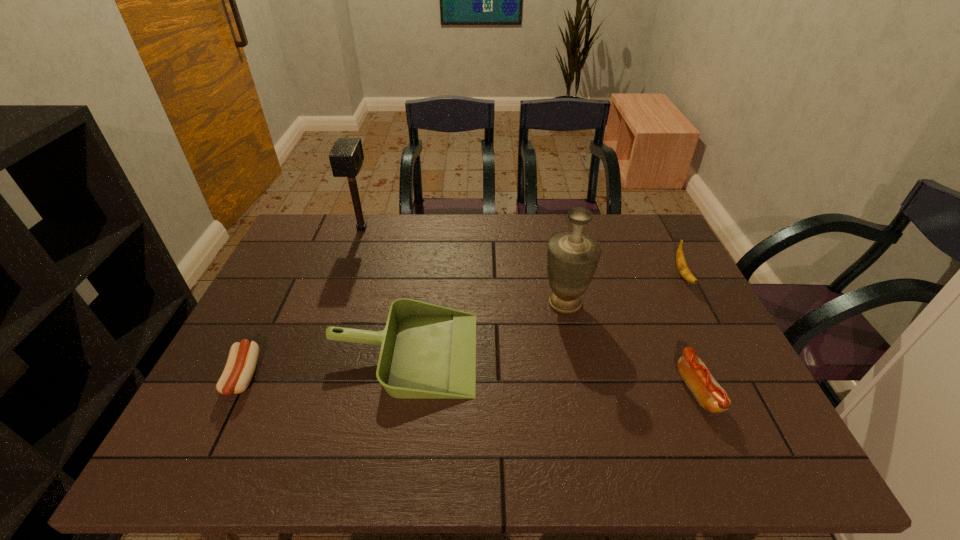
Identify the location of free spot at the left edge of the desktop. The height and width of the screenshot is (540, 960). (302, 261).

The width and height of the screenshot is (960, 540). What are the coordinates of `vacant space at the right edge of the desktop` in the screenshot? It's located at (763, 416).

You are a GUI agent. You are given a task and a screenshot of the screen. Output one action in this format:
    pyautogui.click(x=<x>, y=<y>)
    Task: Click on the unoccupied position between the dustpan and the mallet
    This screenshot has width=960, height=540.
    Given the screenshot: What is the action you would take?
    pyautogui.click(x=383, y=291)

At what (x,y) coordinates should I click in order to perform the action: click on vacant space in between the banana and the urn. Please return your answer as a coordinate pair (x, y). This screenshot has height=540, width=960. Looking at the image, I should click on (624, 289).

What are the coordinates of `vacant space in between the mallet and the shorter sausage` in the screenshot? It's located at (302, 302).

You are a GUI agent. You are given a task and a screenshot of the screen. Output one action in this format:
    pyautogui.click(x=<x>, y=<y>)
    Task: Click on the vacant region between the farthest object and the urn
    This screenshot has height=540, width=960.
    Given the screenshot: What is the action you would take?
    click(464, 266)

Find the location of a particular element. The height and width of the screenshot is (540, 960). empty location between the fourth object from left to right and the rightmost object is located at coordinates (624, 289).

I want to click on vacant region between the dustpan and the farthest object, so click(x=383, y=291).

You are a GUI agent. You are given a task and a screenshot of the screen. Output one action in this format:
    pyautogui.click(x=<x>, y=<y>)
    Task: Click on the free space between the rightmost object and the dustpan
    
    Given the screenshot: What is the action you would take?
    click(x=543, y=314)

Locate an element on the screen. The image size is (960, 540). free spot between the dustpan and the mallet is located at coordinates (383, 291).